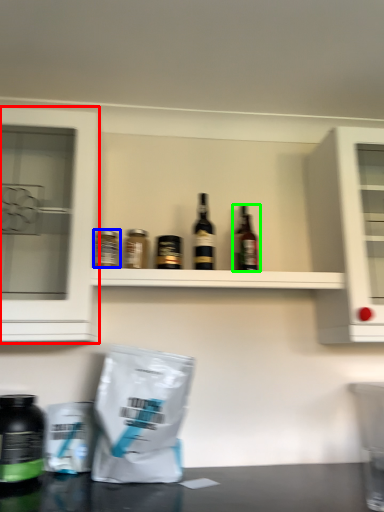
Question: Which is nearer to the cabinetry (highlighted by a red box)? bottle (highlighted by a blue box) or bottle (highlighted by a green box).

Choices:
 (A) bottle
 (B) bottle

Answer: (A)